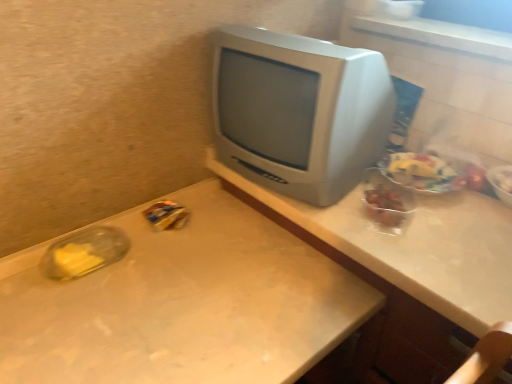
Identify the location of vacant area that is in front of translucent plastic bag at right, which is the 2th food in right-to-left order. (x=446, y=227).